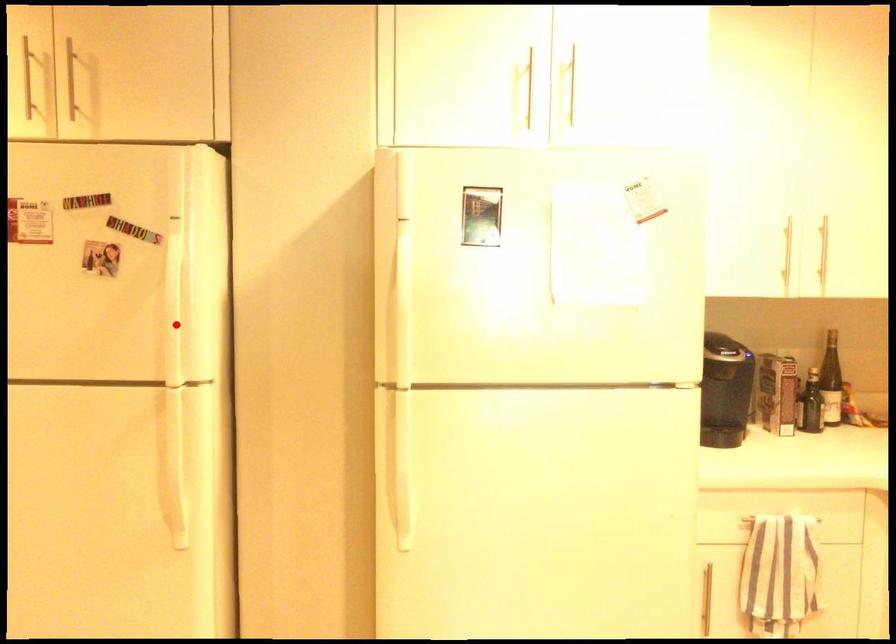
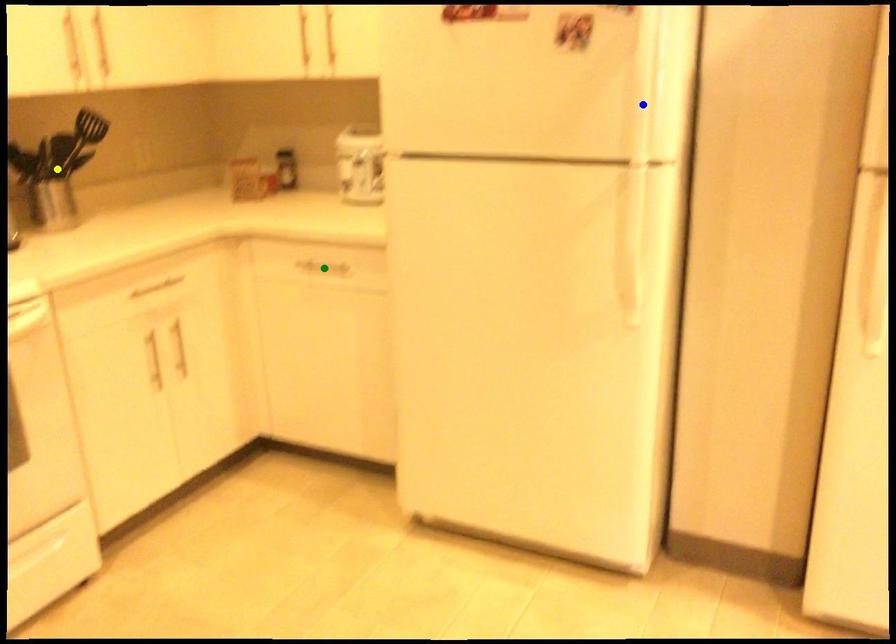
Question: I am providing you with two images of the same scene from different viewpoints. A red point is marked on the first image. You are given multiple points on the second image. Which point in image 2 is actually the same real-world point as the red point in image 1?

Choices:
 (A) green point
 (B) blue point
 (C) yellow point

Answer: (B)